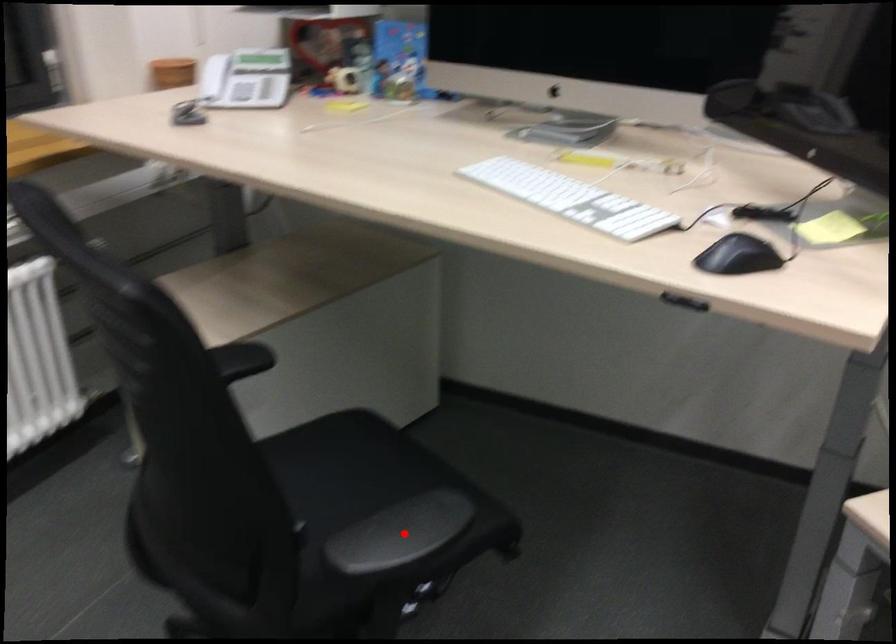
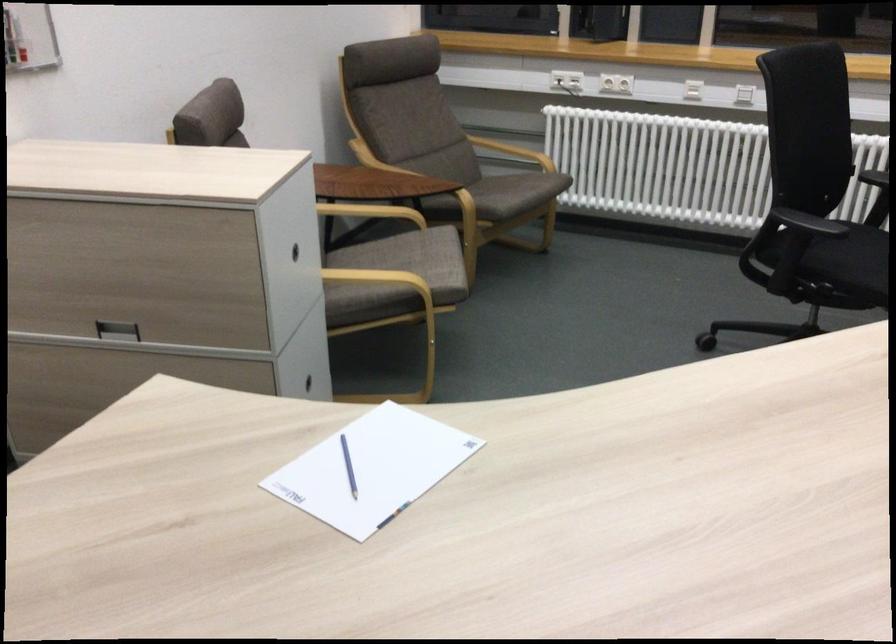
Where in the second image is the point corresponding to the highlighted location from the first image?

(807, 223)